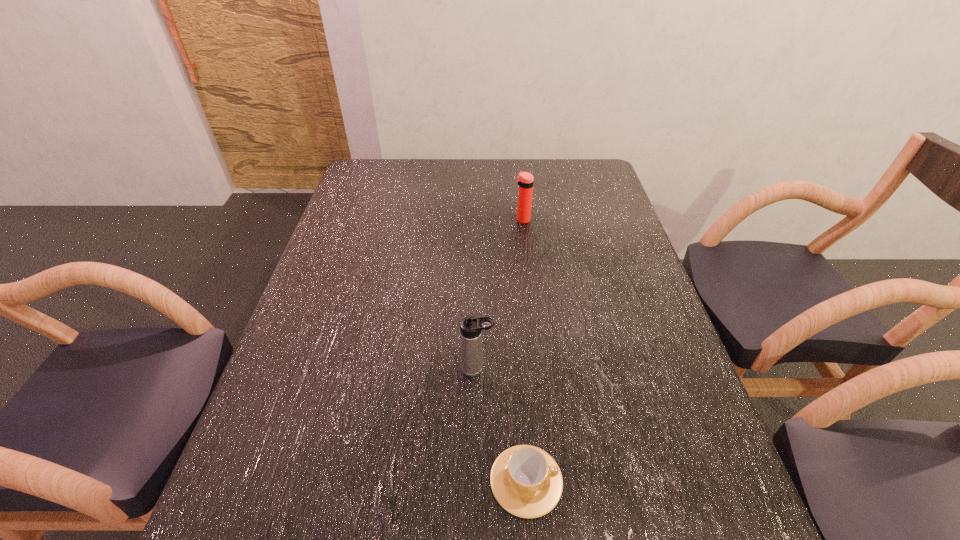
The image size is (960, 540). What are the coordinates of `free location at the left edge` in the screenshot? It's located at (x=318, y=280).

This screenshot has height=540, width=960. In the image, there is a desktop. Identify the location of vacant space at the right edge. point(626,399).

Find the location of a particular element. vacant space at the far left corner of the desktop is located at coordinates (370, 159).

In the image, there is a desktop. At what (x,y) coordinates should I click in order to perform the action: click on free space at the far right corner. Please return your answer as a coordinate pair (x, y). Looking at the image, I should click on (567, 180).

This screenshot has height=540, width=960. In order to click on vacant area that lies between the farther thermos bottle and the left thermos bottle in this screenshot , I will do `click(499, 294)`.

The width and height of the screenshot is (960, 540). In order to click on free space between the shortest object and the left thermos bottle in this screenshot , I will do `click(501, 425)`.

Where is `free space between the farthest object and the shortest object`? The width and height of the screenshot is (960, 540). free space between the farthest object and the shortest object is located at coordinates (524, 350).

Locate an element on the screen. unoccupied position between the second nearest object and the right thermos bottle is located at coordinates (499, 294).

The image size is (960, 540). I want to click on vacant point located between the second farthest object and the shortest object, so click(x=501, y=425).

This screenshot has width=960, height=540. Find the location of `free space between the nearer thermos bottle and the nearest object`. free space between the nearer thermos bottle and the nearest object is located at coordinates (501, 425).